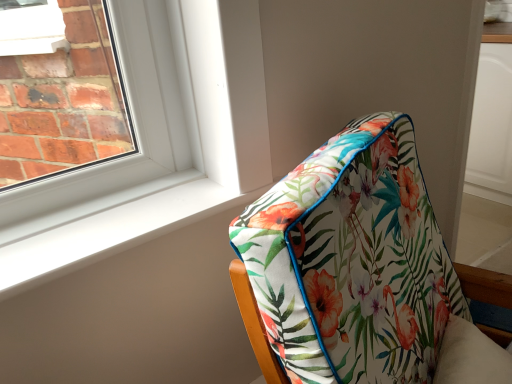
What is the approximate width of white smooth window sill at lower left?

The width of white smooth window sill at lower left is 7.79 inches.

Describe the element at coordinates (105, 228) in the screenshot. I see `white smooth window sill at lower left` at that location.

Image resolution: width=512 pixels, height=384 pixels. What are the coordinates of `white smooth window sill at lower left` in the screenshot? It's located at (105, 228).

What do you see at coordinates (352, 261) in the screenshot? This screenshot has width=512, height=384. I see `floral fabric cushion at center` at bounding box center [352, 261].

The image size is (512, 384). I want to click on floral fabric cushion at center, so click(x=352, y=261).

Locate an element on the screen. white smooth window sill at lower left is located at coordinates (x=105, y=228).

Is floral fabric cushion at center at the right side of white smooth window sill at lower left?

Yes, floral fabric cushion at center is to the right of white smooth window sill at lower left.

Consider the image. Is floral fabric cushion at center in front of or behind white smooth window sill at lower left in the image?

floral fabric cushion at center is positioned closer to the viewer than white smooth window sill at lower left.

Does point (377, 210) lie behind point (173, 226)?

No, (377, 210) is closer to viewer.

From the image's perspective, is floral fabric cushion at center beneath white smooth window sill at lower left?

Yes, from the image's perspective, floral fabric cushion at center is beneath white smooth window sill at lower left.

From a real-world perspective, is floral fabric cushion at center physically below white smooth window sill at lower left?

Correct, in the physical world, floral fabric cushion at center is lower than white smooth window sill at lower left.

Considering the sizes of objects floral fabric cushion at center and white smooth window sill at lower left in the image provided, who is wider, floral fabric cushion at center or white smooth window sill at lower left?

With larger width is floral fabric cushion at center.

Who is taller, floral fabric cushion at center or white smooth window sill at lower left?

Standing taller between the two is floral fabric cushion at center.

Considering the sizes of objects floral fabric cushion at center and white smooth window sill at lower left in the image provided, who is smaller, floral fabric cushion at center or white smooth window sill at lower left?

white smooth window sill at lower left.

Could white smooth window sill at lower left be considered to be inside floral fabric cushion at center?

Definitely not — white smooth window sill at lower left is not inside floral fabric cushion at center.

Are floral fabric cushion at center and white smooth window sill at lower left far apart?

No, there isn't a large distance between floral fabric cushion at center and white smooth window sill at lower left.

Is floral fabric cushion at center aimed at white smooth window sill at lower left?

No.

Where is `furniture that is on the right side of white smooth window sill at lower left`? furniture that is on the right side of white smooth window sill at lower left is located at coordinates (352, 261).

Which object is positioned more to the left, white smooth window sill at lower left or floral fabric cushion at center?

white smooth window sill at lower left.

Is the position of white smooth window sill at lower left less distant than that of floral fabric cushion at center?

No, white smooth window sill at lower left is further to the viewer.

Which is behind, point (7, 295) or point (314, 228)?

The point (7, 295) is farther from the camera.

From the image's perspective, which object appears higher, white smooth window sill at lower left or floral fabric cushion at center?

white smooth window sill at lower left is shown above in the image.

From a real-world perspective, does white smooth window sill at lower left stand above floral fabric cushion at center?

Yes, from a real-world perspective, white smooth window sill at lower left is on top of floral fabric cushion at center.

In terms of width, does white smooth window sill at lower left look wider or thinner when compared to floral fabric cushion at center?

white smooth window sill at lower left is thinner than floral fabric cushion at center.

Who is taller, white smooth window sill at lower left or floral fabric cushion at center?

With more height is floral fabric cushion at center.

Can you confirm if white smooth window sill at lower left is smaller than floral fabric cushion at center?

Indeed, white smooth window sill at lower left has a smaller size compared to floral fabric cushion at center.

Is floral fabric cushion at center a part of white smooth window sill at lower left?

No, floral fabric cushion at center is not surrounded by white smooth window sill at lower left.

Is white smooth window sill at lower left not close to floral fabric cushion at center?

white smooth window sill at lower left is actually quite close to floral fabric cushion at center.

Is white smooth window sill at lower left oriented away from floral fabric cushion at center?

No, white smooth window sill at lower left is not facing away from floral fabric cushion at center.

Measure the distance from white smooth window sill at lower left to floral fabric cushion at center.

14.34 inches.

The image size is (512, 384). What are the coordinates of `window sill on the left side of floral fabric cushion at center` in the screenshot? It's located at (105, 228).

The width and height of the screenshot is (512, 384). Identify the location of furniture that appears in front of the white smooth window sill at lower left. (352, 261).

Find the location of a particular element. The height and width of the screenshot is (384, 512). window sill that is above the floral fabric cushion at center (from a real-world perspective) is located at coordinates (105, 228).